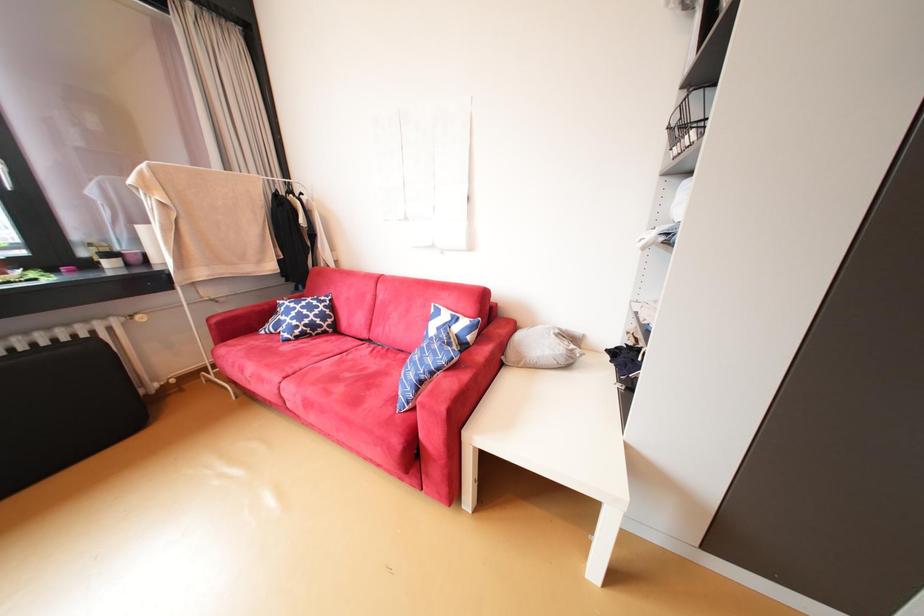
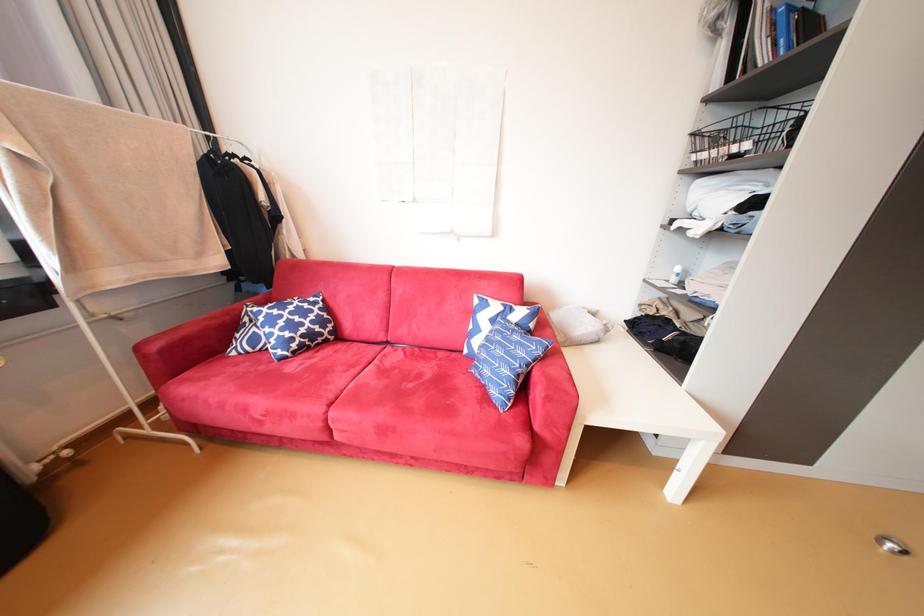
Question: Based on the continuous images, in which direction is the camera rotating? Reply with the corresponding letter.

Choices:
 (A) Left
 (B) Right
 (C) Up
 (D) Down

Answer: (B)